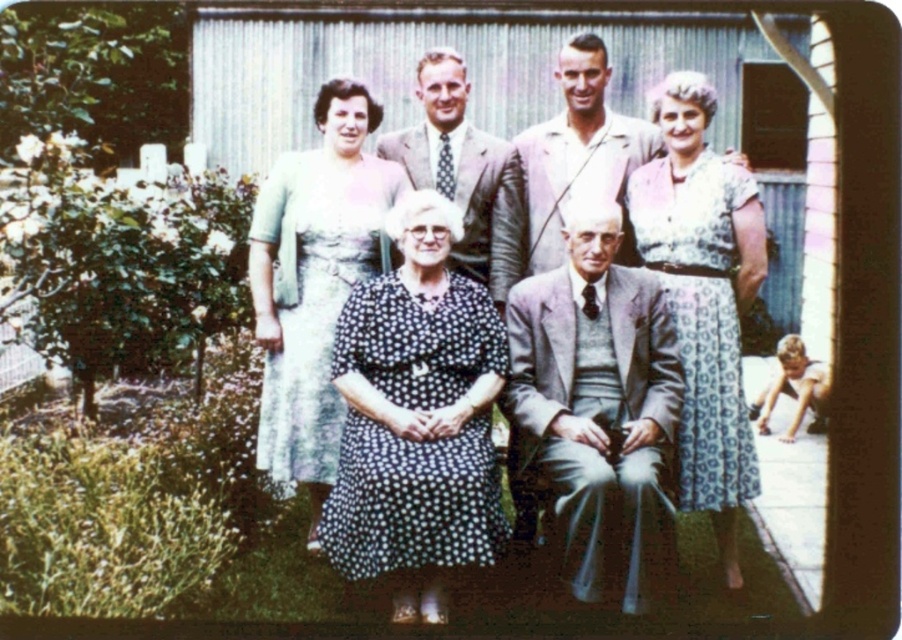
Question: Does printed cotton dress at center appear on the right side of light brown fabric suit at upper center?

Choices:
 (A) no
 (B) yes

Answer: (B)

Question: Which of these objects is positioned farthest from the light blue fabric dress at upper left?

Choices:
 (A) polka dot fabric dress at center
 (B) black dotted dress at center
 (C) printed cotton dress at center
 (D) polka dot dress at center

Answer: (C)

Question: Which object appears farthest from the camera in this image?

Choices:
 (A) printed cotton dress at center
 (B) polka dot dress at center
 (C) light gray suit at center

Answer: (A)

Question: Does light gray suit at center have a greater width compared to polka dot fabric dress at center?

Choices:
 (A) no
 (B) yes

Answer: (A)

Question: Is polka dot fabric dress at center in front of light brown fabric suit at upper center?

Choices:
 (A) yes
 (B) no

Answer: (B)

Question: Estimate the real-world distances between objects in this image. Which object is farther from the black dotted dress at center?

Choices:
 (A) light gray suit at center
 (B) light brown fabric suit at upper center
 (C) printed cotton dress at center

Answer: (B)